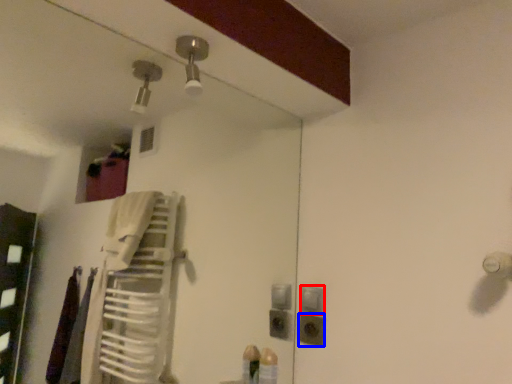
Question: Which object appears closest to the camera in this image, light switch (highlighted by a red box) or electric outlet (highlighted by a blue box)?

Choices:
 (A) light switch
 (B) electric outlet

Answer: (B)